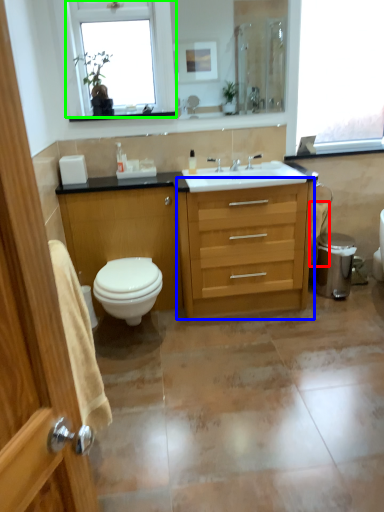
Question: Considering the real-world distances, which object is farthest from toilet paper (highlighted by a red box)? chest of drawers (highlighted by a blue box) or window (highlighted by a green box)?

Choices:
 (A) chest of drawers
 (B) window

Answer: (B)